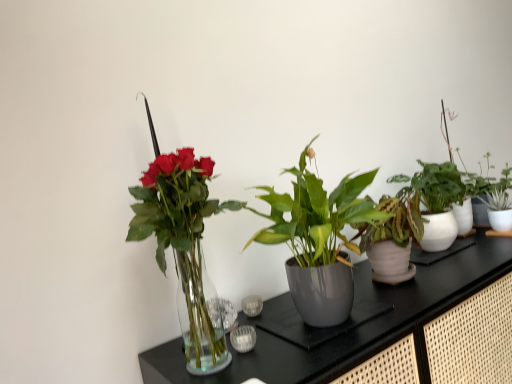
Question: Considering the positions of white glossy pot at right, which is counted as the 1th houseplant, starting from the right, and white ceramic pot at upper right, the 3th houseplant when ordered from left to right, in the image, is white glossy pot at right, which is counted as the 1th houseplant, starting from the right, wider or thinner than white ceramic pot at upper right, the 3th houseplant when ordered from left to right,?

Choices:
 (A) thin
 (B) wide

Answer: (A)

Question: Do you think white glossy pot at right, acting as the 4th houseplant starting from the left, is within white ceramic pot at upper right, which ranks as the second houseplant in right-to-left order, or outside of it?

Choices:
 (A) outside
 (B) inside

Answer: (A)

Question: Which object is positioned farthest from the green glossy plant at center, marked as the 1th houseplant in a left-to-right arrangement?

Choices:
 (A) white glossy pot at right, which is counted as the 1th houseplant, starting from the right
 (B) glossy ceramic plant pot at center, the 3th houseplant when ordered from right to left
 (C) white ceramic pot at upper right, the 3th houseplant when ordered from left to right
 (D) transparent glass vase at left

Answer: (A)

Question: Estimate the real-world distances between objects in this image. Which object is farther from the white glossy pot at right, which is counted as the 1th houseplant, starting from the right?

Choices:
 (A) white ceramic pot at upper right, which ranks as the second houseplant in right-to-left order
 (B) glossy ceramic plant pot at center, the 3th houseplant when ordered from right to left
 (C) transparent glass vase at left
 (D) green glossy plant at center, marked as the 1th houseplant in a left-to-right arrangement

Answer: (D)